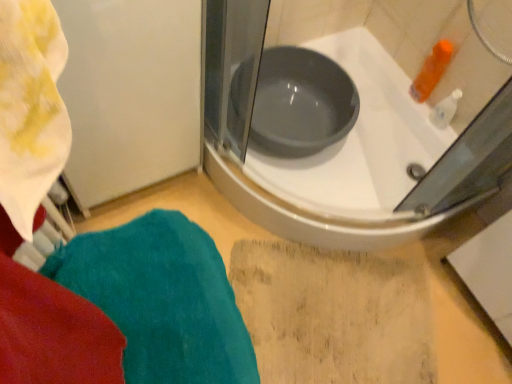
Image resolution: width=512 pixels, height=384 pixels. I want to click on empty space that is ontop of teal plush towel at lower left (from a real-world perspective), so click(x=160, y=292).